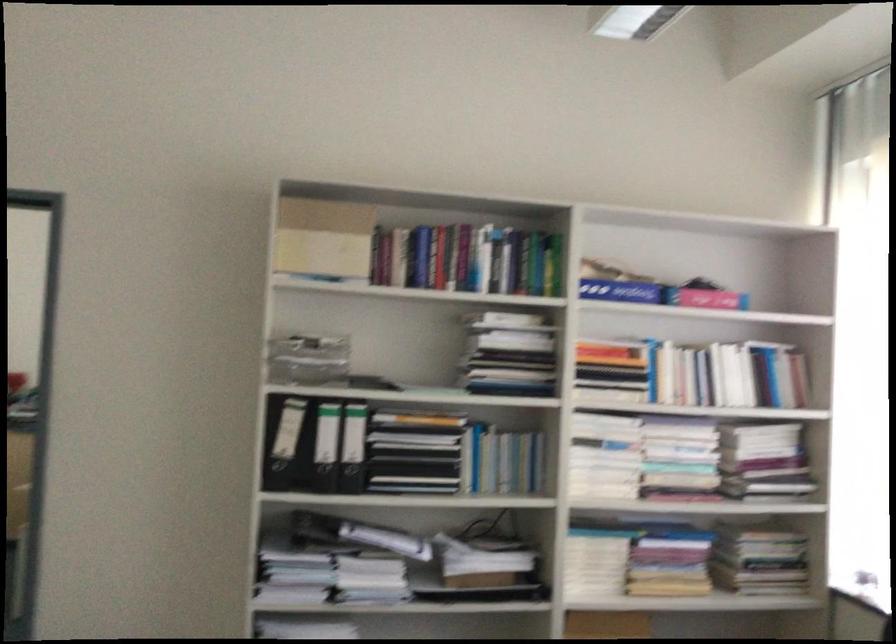
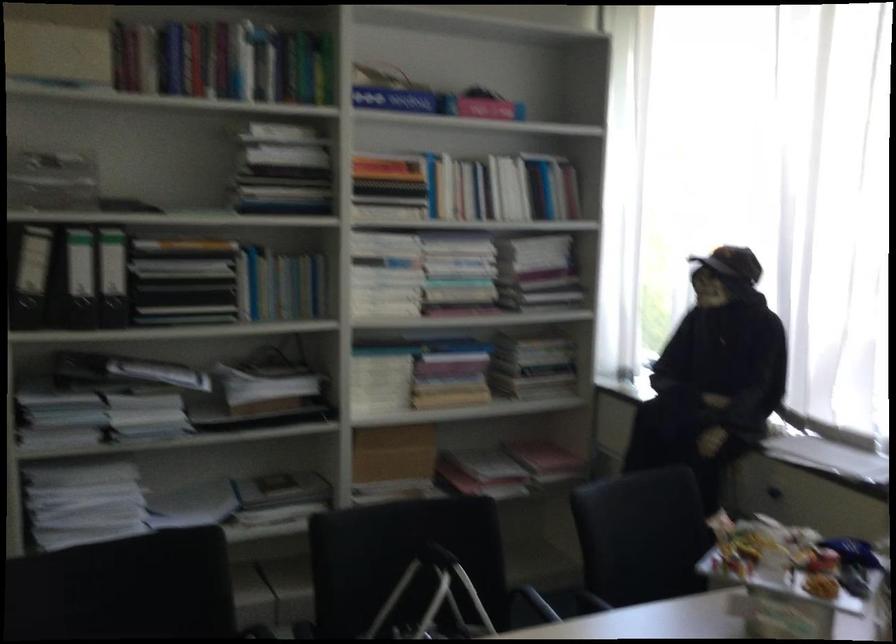
Locate, in the second image, the point that corresponds to point (276, 442) in the first image.

(29, 274)